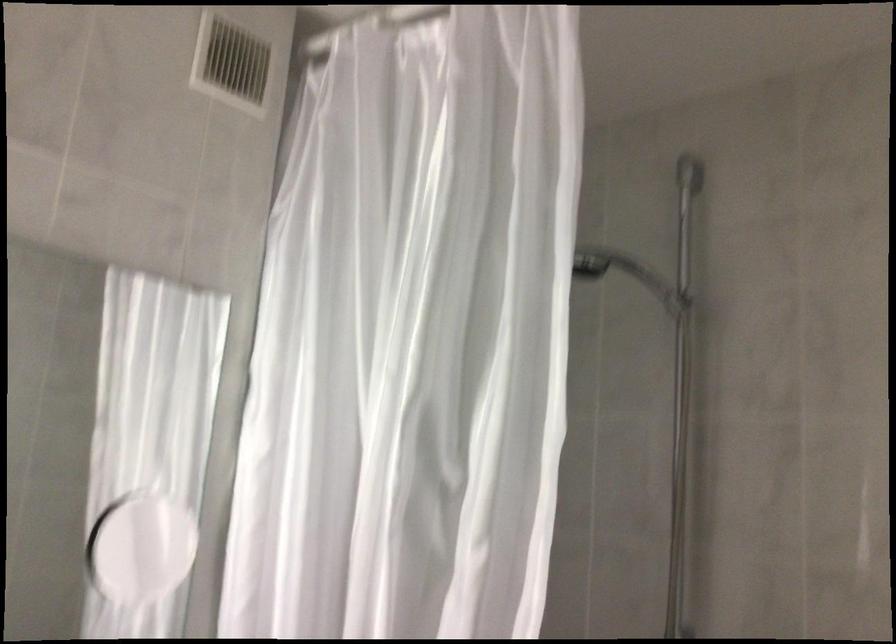
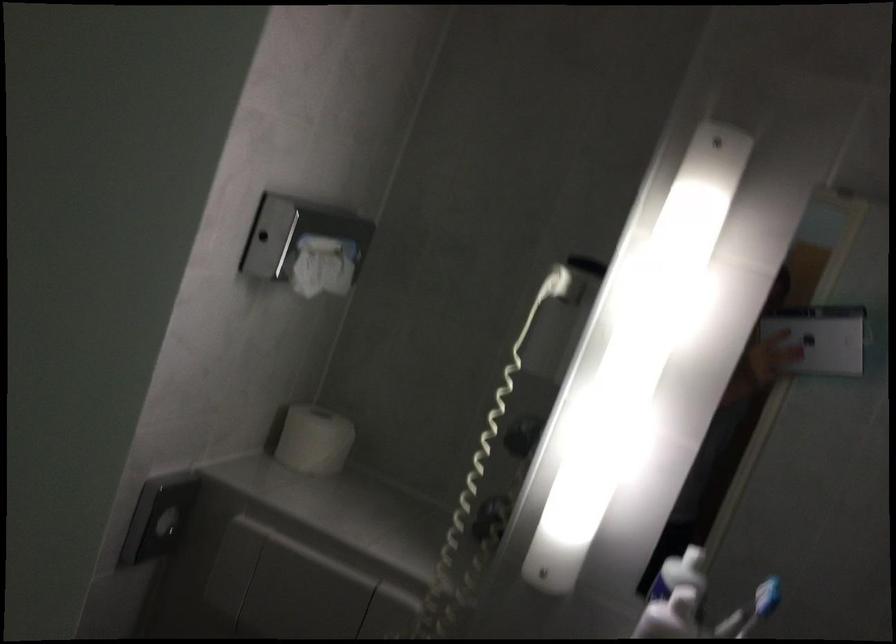
Question: The camera is either moving clockwise (left) or counter-clockwise (right) around the object. The first image is from the beginning of the video and the second image is from the end. Is the camera moving left or right when shooting the video?

Choices:
 (A) Left
 (B) Right

Answer: (B)